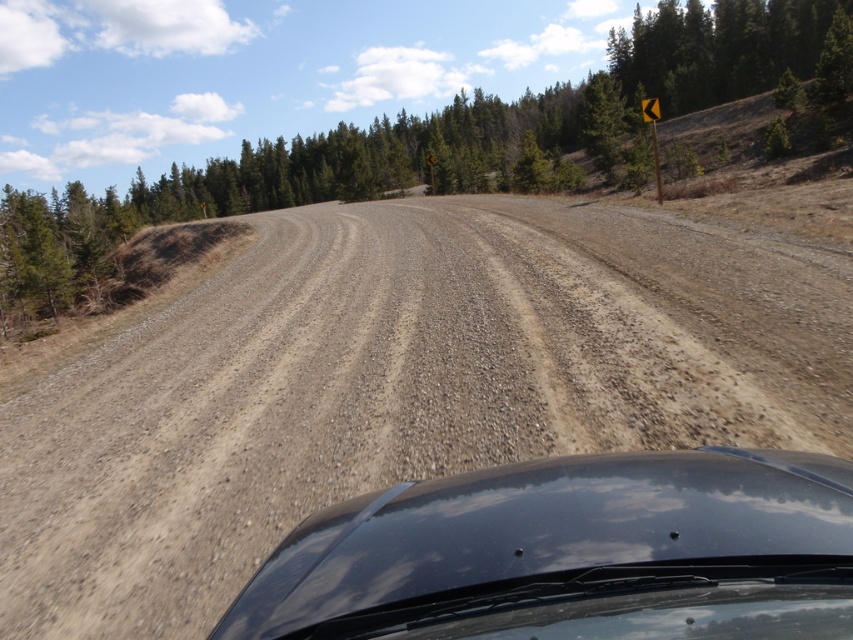
Between point (170, 326) and point (585, 525), which one is positioned behind?

The point (170, 326) is behind.

Can you confirm if dusty gravel road at center is positioned to the right of glossy black car at center?

No, dusty gravel road at center is not to the right of glossy black car at center.

Is point (340, 291) positioned in front of point (329, 563)?

No.

At what (x,y) coordinates should I click in order to perform the action: click on dusty gravel road at center. Please return your answer as a coordinate pair (x, y). Looking at the image, I should click on (396, 387).